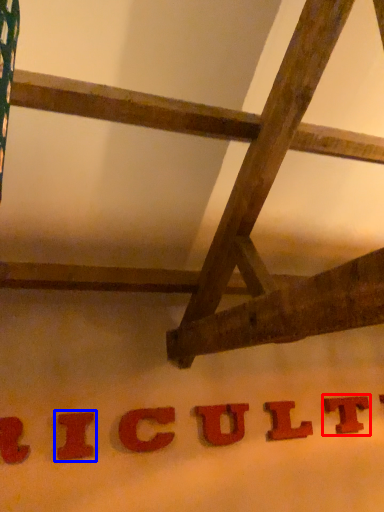
Question: Which of the following is the farthest to the observer, letter (highlighted by a red box) or letter (highlighted by a blue box)?

Choices:
 (A) letter
 (B) letter

Answer: (A)